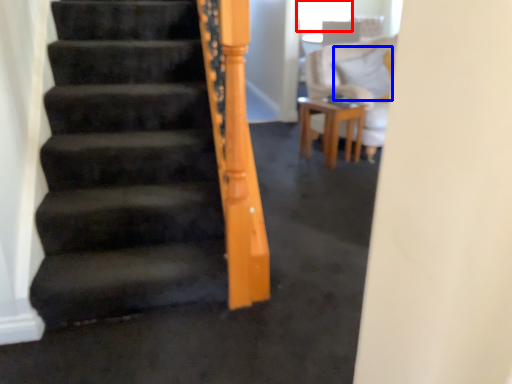
Question: Among these objects, which one is nearest to the camera, window screen (highlighted by a red box) or pillow (highlighted by a blue box)?

Choices:
 (A) window screen
 (B) pillow

Answer: (B)